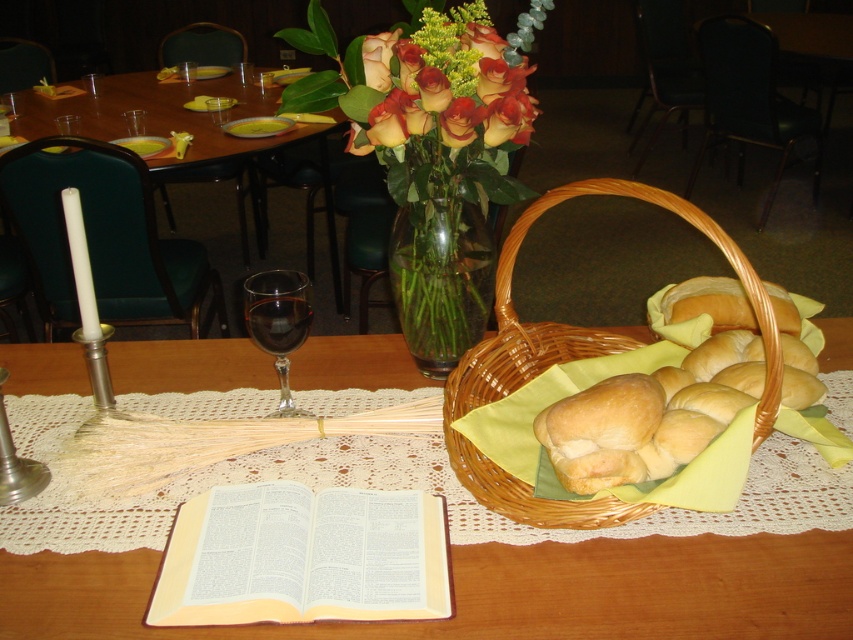
Is woven brown basket at center closer to camera compared to matte orange roses at upper center?

Yes, it is in front of matte orange roses at upper center.

Does woven brown basket at center have a greater width compared to matte orange roses at upper center?

Correct, the width of woven brown basket at center exceeds that of matte orange roses at upper center.

Does point (640, 509) lie behind point (511, 90)?

No, (640, 509) is closer to viewer.

This screenshot has width=853, height=640. Identify the location of woven brown basket at center. (573, 358).

Does light brown leather book at center come behind transparent glass at center?

No, light brown leather book at center is in front of transparent glass at center.

The height and width of the screenshot is (640, 853). What do you see at coordinates (303, 556) in the screenshot?
I see `light brown leather book at center` at bounding box center [303, 556].

Who is more distant from viewer, (241, 547) or (281, 381)?

Positioned behind is point (281, 381).

The width and height of the screenshot is (853, 640). Find the location of `light brown leather book at center`. light brown leather book at center is located at coordinates (303, 556).

What do you see at coordinates (303, 556) in the screenshot? This screenshot has height=640, width=853. I see `light brown leather book at center` at bounding box center [303, 556].

Does light brown leather book at center have a lesser width compared to woven brown basket at center?

Yes.

Locate an element on the screen. light brown leather book at center is located at coordinates (303, 556).